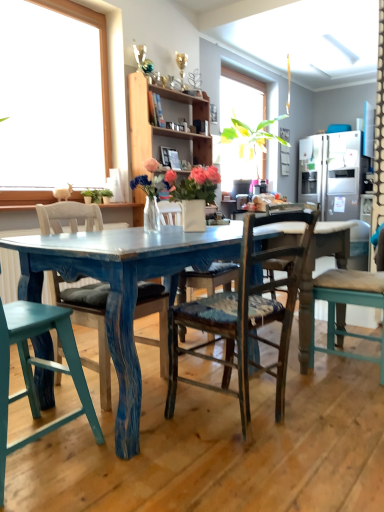
Question: Is distressed teal chair at center, arranged as the 2th chair when viewed from the left, bigger than wooden chair with cushion at right, the 1th chair positioned from the right?

Choices:
 (A) no
 (B) yes

Answer: (B)

Question: Is distressed teal chair at center, arranged as the 2th chair when viewed from the left, thinner than wooden chair with cushion at right, the 1th chair positioned from the right?

Choices:
 (A) yes
 (B) no

Answer: (B)

Question: Considering the relative sizes of distressed teal chair at center, placed as the 3th chair when sorted from right to left, and wooden chair with cushion at right, acting as the fourth chair starting from the left, in the image provided, is distressed teal chair at center, placed as the 3th chair when sorted from right to left, wider than wooden chair with cushion at right, acting as the fourth chair starting from the left,?

Choices:
 (A) no
 (B) yes

Answer: (B)

Question: Are distressed teal chair at center, arranged as the 2th chair when viewed from the left, and wooden chair with cushion at right, acting as the fourth chair starting from the left, making contact?

Choices:
 (A) yes
 (B) no

Answer: (B)

Question: From the image's perspective, would you say distressed teal chair at center, arranged as the 2th chair when viewed from the left, is shown under wooden chair with cushion at right, acting as the fourth chair starting from the left?

Choices:
 (A) no
 (B) yes

Answer: (B)

Question: From the image's perspective, is distressed teal chair at center, arranged as the 2th chair when viewed from the left, located above or below teal wood chair at lower left, which is the 4th chair in right-to-left order?

Choices:
 (A) below
 (B) above

Answer: (B)

Question: Is point (165, 375) positioned closer to the camera than point (51, 328)?

Choices:
 (A) closer
 (B) farther

Answer: (B)

Question: Looking at the image, does distressed teal chair at center, placed as the 3th chair when sorted from right to left, seem bigger or smaller compared to teal wood chair at lower left, which is the 4th chair in right-to-left order?

Choices:
 (A) big
 (B) small

Answer: (A)

Question: Relative to teal wood chair at lower left, marked as the 1th chair in a left-to-right arrangement, is distressed teal chair at center, placed as the 3th chair when sorted from right to left, in front or behind?

Choices:
 (A) behind
 (B) front

Answer: (A)

Question: Based on their sizes in the image, would you say matte white vase at center is bigger or smaller than distressed teal chair at center, arranged as the 2th chair when viewed from the left?

Choices:
 (A) small
 (B) big

Answer: (A)

Question: In terms of height, does matte white vase at center look taller or shorter compared to distressed teal chair at center, arranged as the 2th chair when viewed from the left?

Choices:
 (A) tall
 (B) short

Answer: (B)

Question: Considering the positions of matte white vase at center and distressed teal chair at center, placed as the 3th chair when sorted from right to left, in the image, is matte white vase at center wider or thinner than distressed teal chair at center, placed as the 3th chair when sorted from right to left,?

Choices:
 (A) thin
 (B) wide

Answer: (A)

Question: In the image, is matte white vase at center positioned in front of or behind distressed teal chair at center, arranged as the 2th chair when viewed from the left?

Choices:
 (A) front
 (B) behind

Answer: (B)

Question: Considering the relative positions of satin silver refrigerator at right and distressed teal chair at center, arranged as the 2th chair when viewed from the left, in the image provided, is satin silver refrigerator at right to the left or to the right of distressed teal chair at center, arranged as the 2th chair when viewed from the left,?

Choices:
 (A) left
 (B) right

Answer: (B)

Question: Is satin silver refrigerator at right in front of or behind distressed teal chair at center, arranged as the 2th chair when viewed from the left, in the image?

Choices:
 (A) behind
 (B) front

Answer: (A)